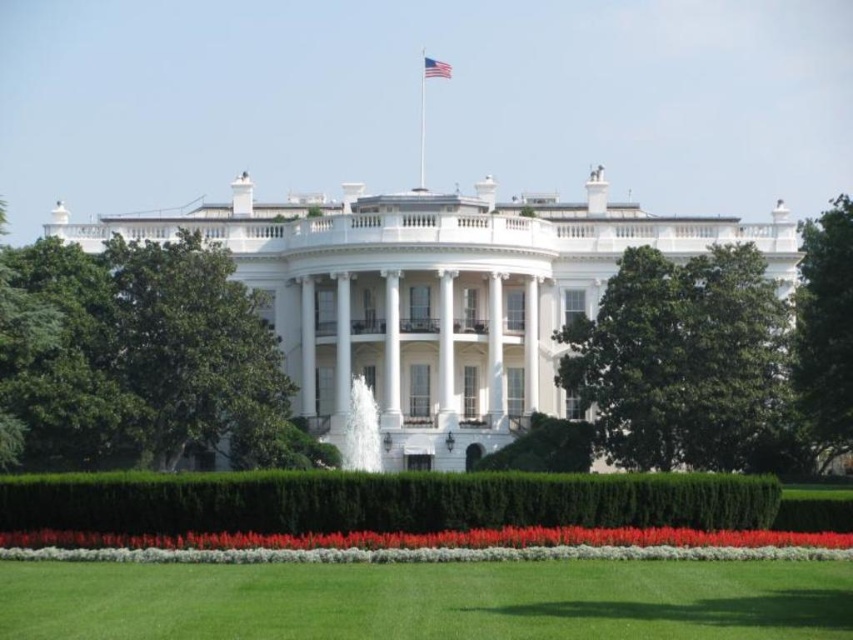
The width and height of the screenshot is (853, 640). What do you see at coordinates (686, 364) in the screenshot?
I see `green leafy tree at center` at bounding box center [686, 364].

Between green leafy tree at center and green leafy hedge at center, which one has less height?

With less height is green leafy hedge at center.

You are a GUI agent. You are given a task and a screenshot of the screen. Output one action in this format:
    pyautogui.click(x=<x>, y=<y>)
    Task: Click on the green leafy tree at center
    The width and height of the screenshot is (853, 640).
    Given the screenshot: What is the action you would take?
    pyautogui.click(x=686, y=364)

Locate an element on the screen. green leafy tree at center is located at coordinates (686, 364).

Does point (805, 308) come closer to viewer compared to point (438, 74)?

That is True.

Who is more distant from viewer, (848, 426) or (426, 68)?

The point (426, 68) is more distant.

Identify the location of green leafy tree at right. This screenshot has height=640, width=853. (825, 332).

This screenshot has width=853, height=640. I want to click on green leafy hedge at center, so click(x=379, y=500).

Can you confirm if green leafy hedge at center is bigger than green leafy bush at center?

Indeed, green leafy hedge at center has a larger size compared to green leafy bush at center.

The image size is (853, 640). What do you see at coordinates (379, 500) in the screenshot?
I see `green leafy hedge at center` at bounding box center [379, 500].

Locate an element on the screen. The image size is (853, 640). green leafy hedge at center is located at coordinates (379, 500).